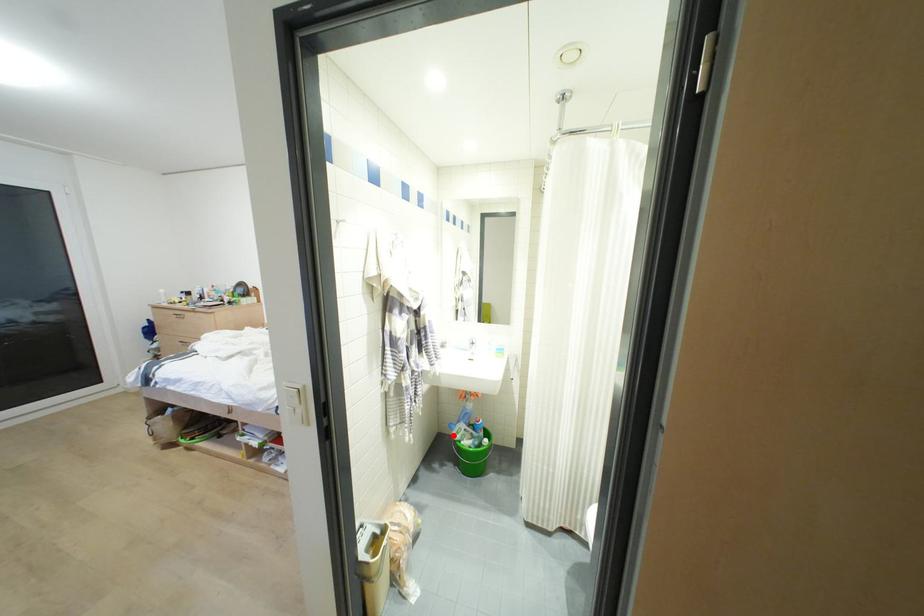
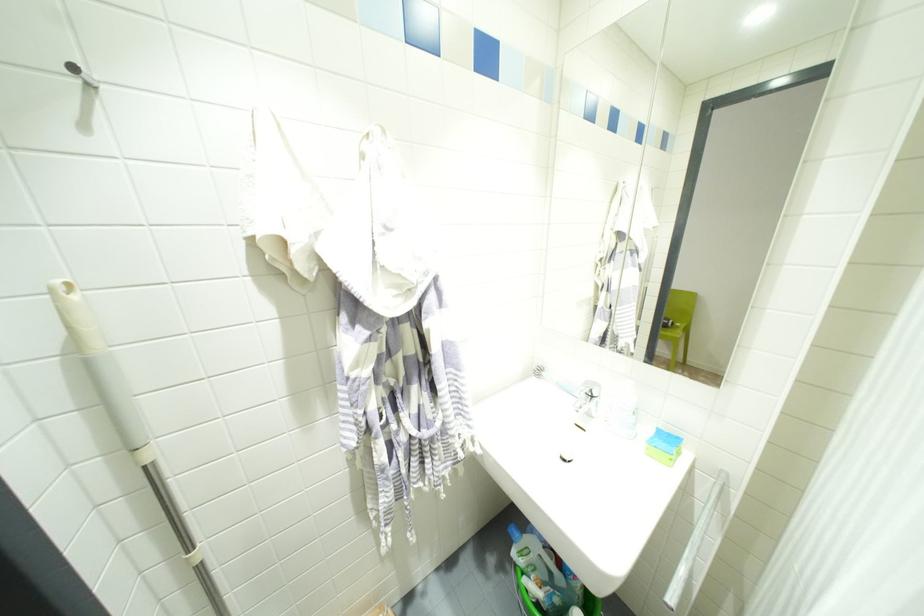
Question: A red point is marked in image1. In image2, is the corresponding 3D point closer to the camera or farther? Reply with the corresponding letter.

Choices:
 (A) The corresponding 3D point is closer.
 (B) The corresponding 3D point is farther.

Answer: (A)